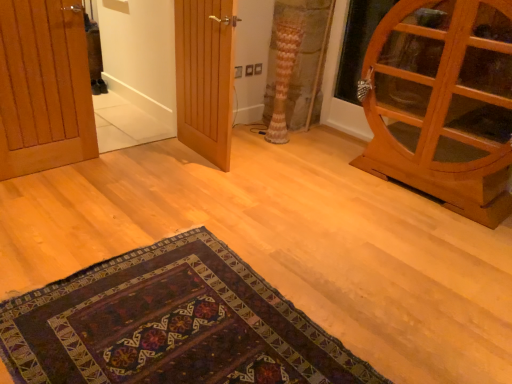
Locate an element on the screen. free location to the left of wooden cabinet at right, positioned as the 1th door in right-to-left order is located at coordinates (324, 184).